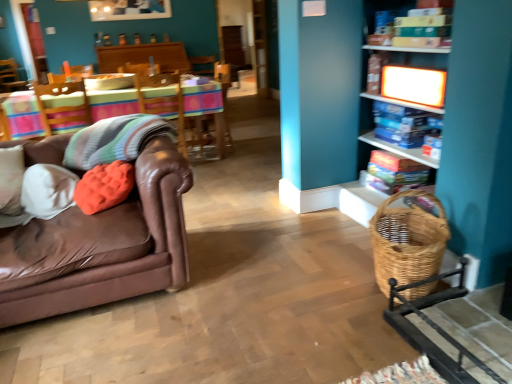
Question: Should I look upward or downward to see brown leather couch at left?

Choices:
 (A) up
 (B) down

Answer: (B)

Question: Does woven brown basket at lower right lie behind woven wicker rocking chair at lower right?

Choices:
 (A) yes
 (B) no

Answer: (A)

Question: Is woven brown basket at lower right facing away from woven wicker rocking chair at lower right?

Choices:
 (A) no
 (B) yes

Answer: (A)

Question: From the image's perspective, is woven brown basket at lower right on woven wicker rocking chair at lower right?

Choices:
 (A) yes
 (B) no

Answer: (A)

Question: Does woven brown basket at lower right appear on the left side of woven wicker rocking chair at lower right?

Choices:
 (A) no
 (B) yes

Answer: (B)

Question: Considering the relative sizes of woven brown basket at lower right and woven wicker rocking chair at lower right in the image provided, is woven brown basket at lower right bigger than woven wicker rocking chair at lower right?

Choices:
 (A) no
 (B) yes

Answer: (A)

Question: Considering the relative sizes of woven brown basket at lower right and woven wicker rocking chair at lower right in the image provided, is woven brown basket at lower right smaller than woven wicker rocking chair at lower right?

Choices:
 (A) no
 (B) yes

Answer: (B)

Question: Does woven wicker rocking chair at lower right turn towards wooden shelf at right, positioned as the 1th shelf in bottom-to-top order?

Choices:
 (A) yes
 (B) no

Answer: (B)

Question: From the image's perspective, does woven wicker rocking chair at lower right appear higher than wooden shelf at right, which is the 3th shelf from top to bottom?

Choices:
 (A) yes
 (B) no

Answer: (B)

Question: Does woven wicker rocking chair at lower right have a greater width compared to wooden shelf at right, which is the 3th shelf from top to bottom?

Choices:
 (A) yes
 (B) no

Answer: (A)

Question: Is woven wicker rocking chair at lower right positioned in front of wooden shelf at right, positioned as the 1th shelf in bottom-to-top order?

Choices:
 (A) yes
 (B) no

Answer: (A)

Question: Is woven wicker rocking chair at lower right further to camera compared to wooden shelf at right, positioned as the 1th shelf in bottom-to-top order?

Choices:
 (A) yes
 (B) no

Answer: (B)

Question: Can you confirm if woven wicker rocking chair at lower right is smaller than wooden shelf at right, which is the 3th shelf from top to bottom?

Choices:
 (A) no
 (B) yes

Answer: (B)

Question: Does woven brown basket at lower right have a greater width compared to wooden shelf at right, positioned as the 1th shelf in bottom-to-top order?

Choices:
 (A) yes
 (B) no

Answer: (B)